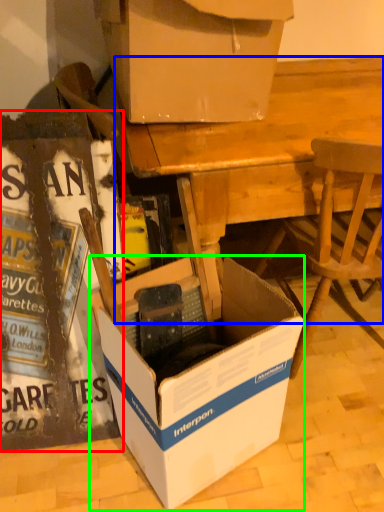
Question: Considering the real-world distances, which object is closest to box (highlighted by a red box)? desk (highlighted by a blue box) or box (highlighted by a green box).

Choices:
 (A) desk
 (B) box

Answer: (B)